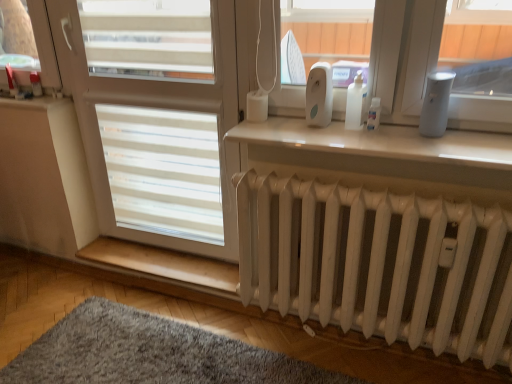
Image resolution: width=512 pixels, height=384 pixels. What do you see at coordinates (319, 95) in the screenshot?
I see `white plastic device at upper center` at bounding box center [319, 95].

Describe the element at coordinates (163, 263) in the screenshot. I see `light brown wood at lower center` at that location.

At what (x,y) coordinates should I click in order to perform the action: click on white glossy radiator at lower center. Please return your answer as a coordinate pair (x, y). Looking at the image, I should click on (380, 142).

Where is `white plastic device at upper center`? Image resolution: width=512 pixels, height=384 pixels. white plastic device at upper center is located at coordinates (319, 95).

Does white plastic device at upper center turn towards white matte radiator at lower center?

No.

Would you say white plastic device at upper center is outside white matte radiator at lower center?

Yes.

Which is more to the left, gray fluffy rug at lower left or white matte screen door at center?

white matte screen door at center is more to the left.

From the image's perspective, does gray fluffy rug at lower left appear higher than white matte screen door at center?

No, from the image's perspective, gray fluffy rug at lower left is not over white matte screen door at center.

Choose the correct answer: Is gray fluffy rug at lower left inside white matte screen door at center or outside it?

gray fluffy rug at lower left lies outside white matte screen door at center.

Considering the sizes of objects gray fluffy rug at lower left and white glossy radiator at lower center in the image provided, who is bigger, gray fluffy rug at lower left or white glossy radiator at lower center?

gray fluffy rug at lower left is bigger.

Looking at this image, does gray fluffy rug at lower left have a greater height compared to white glossy radiator at lower center?

Yes, gray fluffy rug at lower left is taller than white glossy radiator at lower center.

Is gray fluffy rug at lower left to the left of white glossy radiator at lower center from the viewer's perspective?

Correct, you'll find gray fluffy rug at lower left to the left of white glossy radiator at lower center.

Would you say gray fluffy rug at lower left is inside or outside white glossy radiator at lower center?

gray fluffy rug at lower left is located beyond the bounds of white glossy radiator at lower center.

Which point is more forward, (133, 264) or (161, 30)?

The point (161, 30) is more forward.

Considering the sizes of objects light brown wood at lower center and white matte screen door at center in the image provided, who is thinner, light brown wood at lower center or white matte screen door at center?

With smaller width is white matte screen door at center.

From the image's perspective, is white glossy radiator at lower center positioned above or below light brown wood at lower center?

From the image's perspective, white glossy radiator at lower center appears above light brown wood at lower center.

In order to click on window sill lying behind the white glossy radiator at lower center in this screenshot , I will do `click(163, 263)`.

Considering the positions of objects white glossy radiator at lower center and light brown wood at lower center in the image provided, who is in front, white glossy radiator at lower center or light brown wood at lower center?

white glossy radiator at lower center is closer to the camera.

In the scene shown: From a real-world perspective, is white glossy radiator at lower center under light brown wood at lower center?

No, from a real-world perspective, white glossy radiator at lower center is not under light brown wood at lower center.

Is point (510, 254) farther from viewer compared to point (91, 48)?

No.

From the image's perspective, between white matte radiator at lower center and white matte screen door at center, who is located below?

From the image's view, white matte radiator at lower center is below.

Visually, is white matte radiator at lower center positioned to the left or to the right of white matte screen door at center?

white matte radiator at lower center is to the right of white matte screen door at center.

Is light brown wood at lower center turned away from white glossy radiator at lower center?

That's not correct — light brown wood at lower center is not looking away from white glossy radiator at lower center.

From the image's perspective, between light brown wood at lower center and white glossy radiator at lower center, who is located below?

light brown wood at lower center.

Between light brown wood at lower center and white glossy radiator at lower center, which one has more height?

Standing taller between the two is light brown wood at lower center.

Between light brown wood at lower center and white glossy radiator at lower center, which one appears on the right side from the viewer's perspective?

white glossy radiator at lower center is more to the right.

Find the location of a particular element. radiator below the white plastic device at upper center (from the image's perspective) is located at coordinates (380, 264).

This screenshot has height=384, width=512. I want to click on screen door on the left of the gray fluffy rug at lower left, so click(155, 116).

Estimate the real-world distances between objects in this image. Which object is closer to white glossy radiator at lower center, light brown wood at lower center or white matte radiator at lower center?

white matte radiator at lower center is closer to white glossy radiator at lower center.

When comparing their distances from light brown wood at lower center, does gray fluffy rug at lower left or white glossy radiator at lower center seem further?

The object further to light brown wood at lower center is white glossy radiator at lower center.

When comparing their distances from gray fluffy rug at lower left, does white matte screen door at center or white plastic device at upper center seem further?

white plastic device at upper center lies further to gray fluffy rug at lower left than the other object.

Based on their spatial positions, is light brown wood at lower center or white matte screen door at center closer to gray fluffy rug at lower left?

light brown wood at lower center.

Based on their spatial positions, is light brown wood at lower center or white glossy radiator at lower center further from gray fluffy rug at lower left?

The object further to gray fluffy rug at lower left is white glossy radiator at lower center.

When comparing their distances from white glossy radiator at lower center, does gray fluffy rug at lower left or white plastic device at upper center seem further?

The object further to white glossy radiator at lower center is gray fluffy rug at lower left.

From the picture: Looking at the image, which one is located closer to white matte radiator at lower center, white glossy radiator at lower center or gray fluffy rug at lower left?

white glossy radiator at lower center lies closer to white matte radiator at lower center than the other object.

Based on their spatial positions, is white plastic device at upper center or gray fluffy rug at lower left closer to white matte radiator at lower center?

Among the two, gray fluffy rug at lower left is located nearer to white matte radiator at lower center.

Identify the location of window sill that lies between white glossy radiator at lower center and gray fluffy rug at lower left from top to bottom. (163, 263).

Locate an element on the screen. Image resolution: width=512 pixels, height=384 pixels. window sill between white matte screen door at center and gray fluffy rug at lower left vertically is located at coordinates (163, 263).

Where is `window sill that lies between white plastic device at upper center and gray fluffy rug at lower left from top to bottom`? Image resolution: width=512 pixels, height=384 pixels. window sill that lies between white plastic device at upper center and gray fluffy rug at lower left from top to bottom is located at coordinates (163, 263).

Where is `window between white plastic device at upper center and white matte radiator at lower center in the vertical direction`? The height and width of the screenshot is (384, 512). window between white plastic device at upper center and white matte radiator at lower center in the vertical direction is located at coordinates (380, 142).